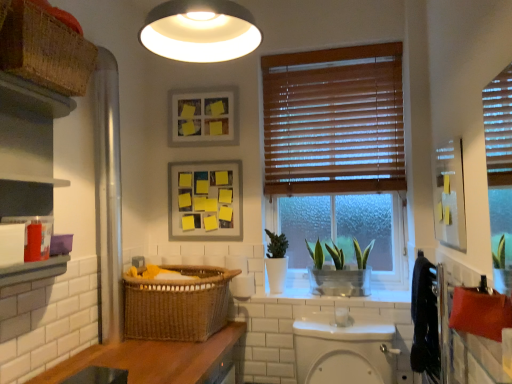
This screenshot has width=512, height=384. I want to click on empty space that is ontop of wooden countertop at lower left (from a real-world perspective), so click(x=166, y=351).